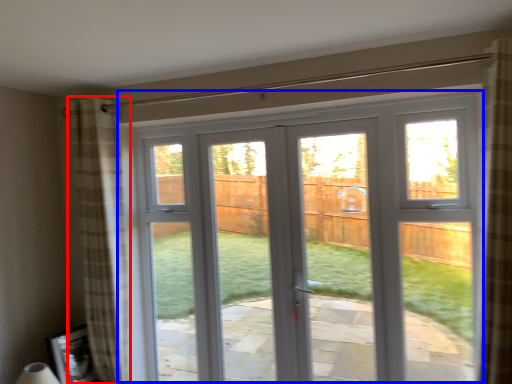
Question: Which object appears farthest to the camera in this image, curtain (highlighted by a red box) or window (highlighted by a blue box)?

Choices:
 (A) curtain
 (B) window

Answer: (A)